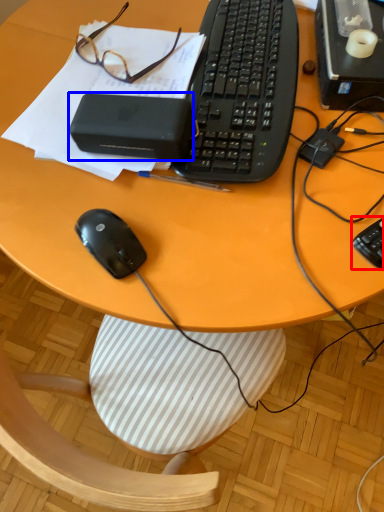
Question: Among these objects, which one is farthest to the camera, computer keyboard (highlighted by a red box) or gadget (highlighted by a blue box)?

Choices:
 (A) computer keyboard
 (B) gadget

Answer: (B)